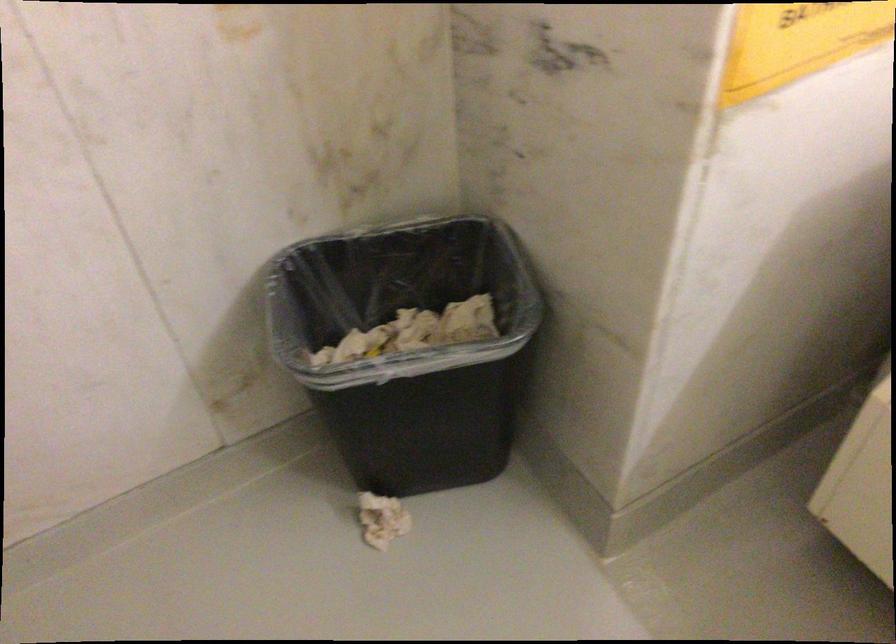
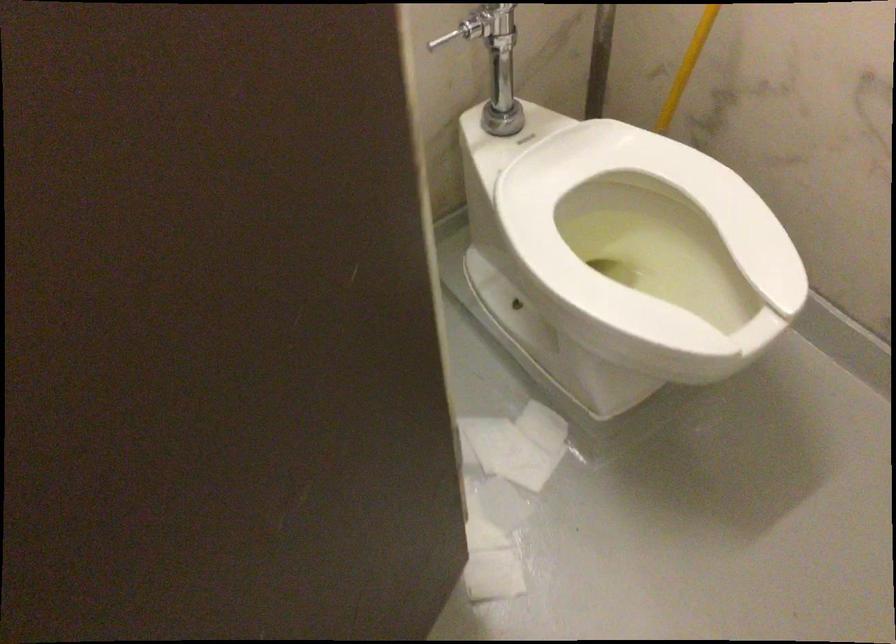
How did the camera likely rotate?

The rotation direction of the camera is right-down.